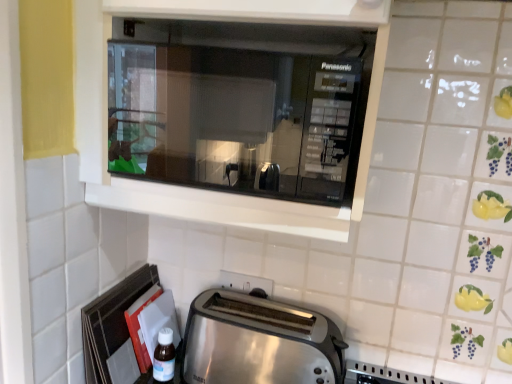
Question: Which direction should I rotate to look at white plastic electric outlet at lower center?

Choices:
 (A) right
 (B) left

Answer: (B)

Question: Can you confirm if transparent plastic bottle at lower left is bigger than white plastic electric outlet at lower center?

Choices:
 (A) yes
 (B) no

Answer: (A)

Question: Is transparent plastic bottle at lower left positioned with its back to white plastic electric outlet at lower center?

Choices:
 (A) yes
 (B) no

Answer: (B)

Question: Considering the relative sizes of transparent plastic bottle at lower left and white plastic electric outlet at lower center in the image provided, is transparent plastic bottle at lower left shorter than white plastic electric outlet at lower center?

Choices:
 (A) yes
 (B) no

Answer: (B)

Question: Are transparent plastic bottle at lower left and white plastic electric outlet at lower center beside each other?

Choices:
 (A) no
 (B) yes

Answer: (A)

Question: Considering the relative positions of transparent plastic bottle at lower left and white plastic electric outlet at lower center in the image provided, is transparent plastic bottle at lower left in front of white plastic electric outlet at lower center?

Choices:
 (A) yes
 (B) no

Answer: (A)

Question: Is transparent plastic bottle at lower left completely or partially outside of white plastic electric outlet at lower center?

Choices:
 (A) yes
 (B) no

Answer: (A)

Question: Considering the relative positions of satin silver toaster at lower center and black glass microwave at upper center in the image provided, is satin silver toaster at lower center to the right of black glass microwave at upper center from the viewer's perspective?

Choices:
 (A) no
 (B) yes

Answer: (B)

Question: Is satin silver toaster at lower center next to black glass microwave at upper center and touching it?

Choices:
 (A) yes
 (B) no

Answer: (B)

Question: Is satin silver toaster at lower center shorter than black glass microwave at upper center?

Choices:
 (A) no
 (B) yes

Answer: (B)

Question: From the image's perspective, is satin silver toaster at lower center on black glass microwave at upper center?

Choices:
 (A) no
 (B) yes

Answer: (A)

Question: Is satin silver toaster at lower center thinner than black glass microwave at upper center?

Choices:
 (A) yes
 (B) no

Answer: (A)

Question: From a real-world perspective, is satin silver toaster at lower center positioned over black glass microwave at upper center based on gravity?

Choices:
 (A) yes
 (B) no

Answer: (B)

Question: Is white plastic electric outlet at lower center to the right of black glass microwave at upper center from the viewer's perspective?

Choices:
 (A) no
 (B) yes

Answer: (A)